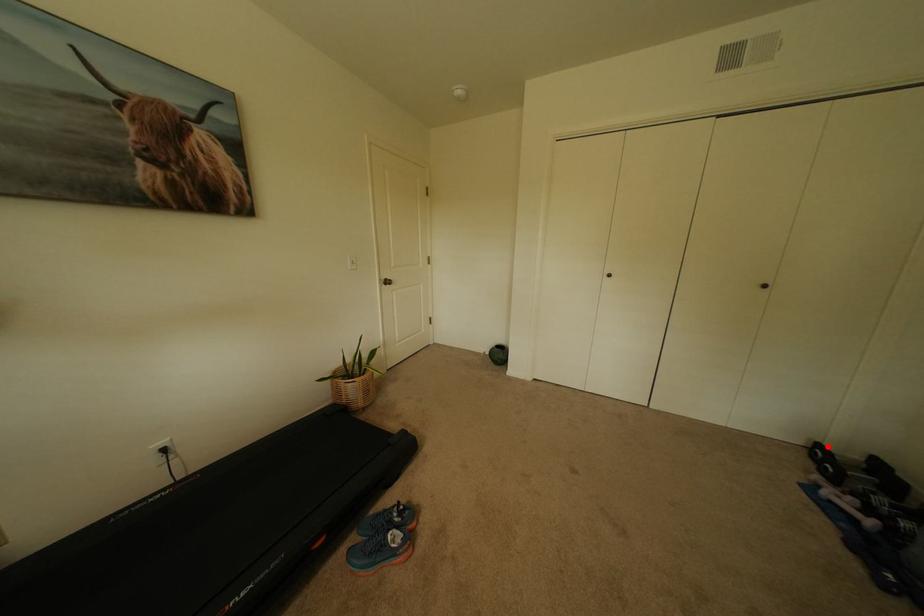
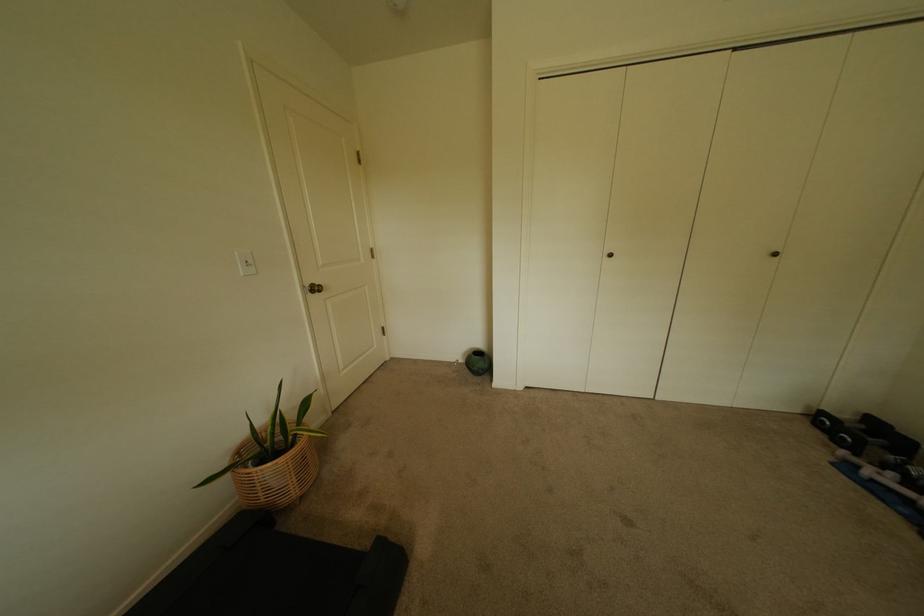
Question: I am providing you with two images of the same scene from different viewpoints. Image1 has a red point marked. In image2, the corresponding 3D location appears at what relative position? Reply with the corresponding letter.

Choices:
 (A) Closer
 (B) Farther

Answer: (B)